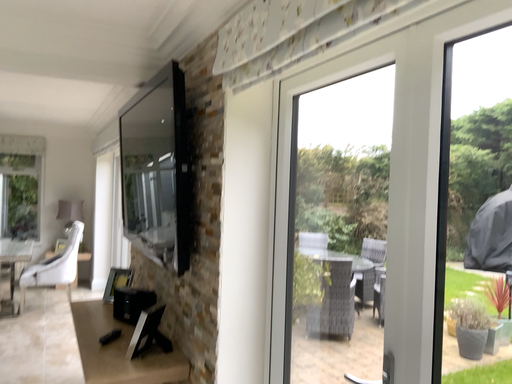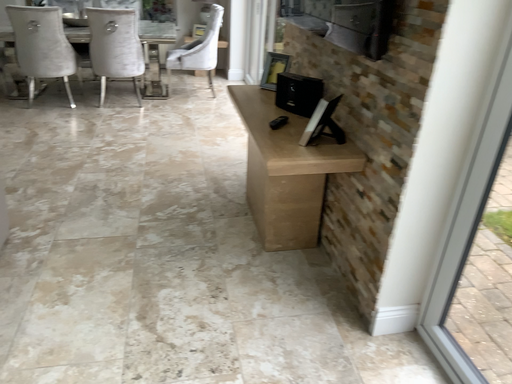
Question: How did the camera likely rotate when shooting the video?

Choices:
 (A) rotated downward
 (B) rotated upward

Answer: (A)